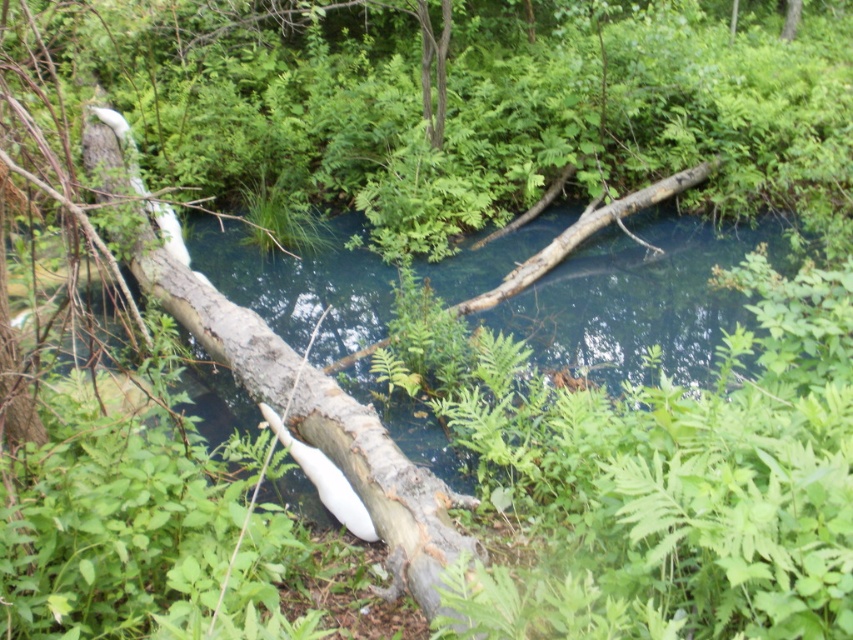
You are an explorer trying to cross the stream. You see the clear water at center and the smooth gray log at center. Which one is narrower, making it harder to step on?

The clear water at center is smaller than smooth gray log at center, so the clear water at center is narrower and harder to step on.

You are standing at the edge of the stream and want to cross to the other side. The fallen tree trunk is slippery, so you decide to step on the clear water at center instead. Is this a safe choice?

The clear water at center is located at point (639, 298), so stepping on it might not be safe as water is generally not a stable surface for walking.